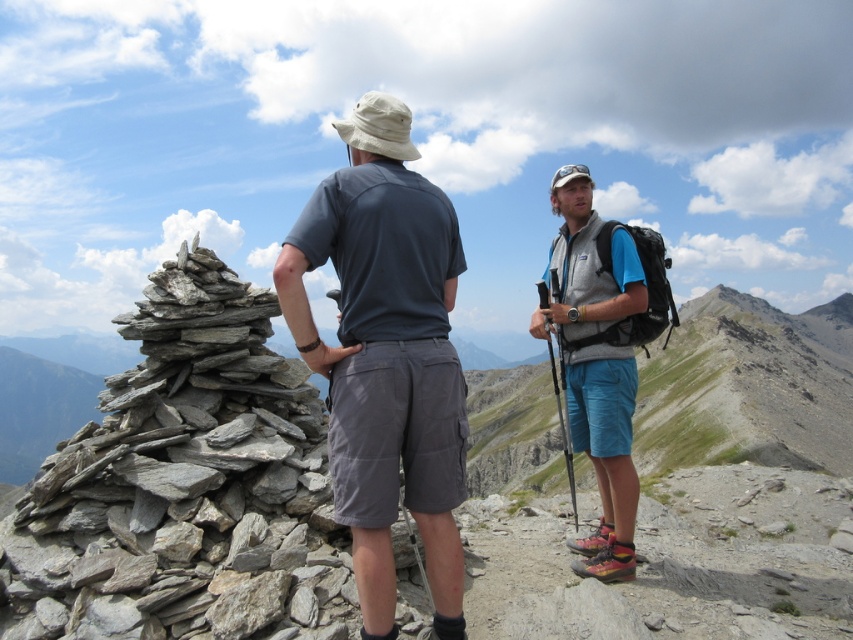
Question: Can you confirm if gray stone cairn at left is thinner than gray fabric shirt at center?

Choices:
 (A) yes
 (B) no

Answer: (B)

Question: Which of the following is the closest to the observer?

Choices:
 (A) (364, 564)
 (B) (589, 241)

Answer: (A)

Question: Based on their relative distances, which object is nearer to the matte gray vest at center?

Choices:
 (A) gray stone cairn at left
 (B) gray fabric shirt at center

Answer: (B)

Question: Is gray stone cairn at left to the left of matte gray vest at center from the viewer's perspective?

Choices:
 (A) yes
 (B) no

Answer: (A)

Question: Estimate the real-world distances between objects in this image. Which object is closer to the matte gray vest at center?

Choices:
 (A) gray stone cairn at left
 (B) gray fabric shirt at center

Answer: (B)

Question: Observing the image, what is the correct spatial positioning of gray fabric shirt at center in reference to matte gray vest at center?

Choices:
 (A) above
 (B) below

Answer: (A)